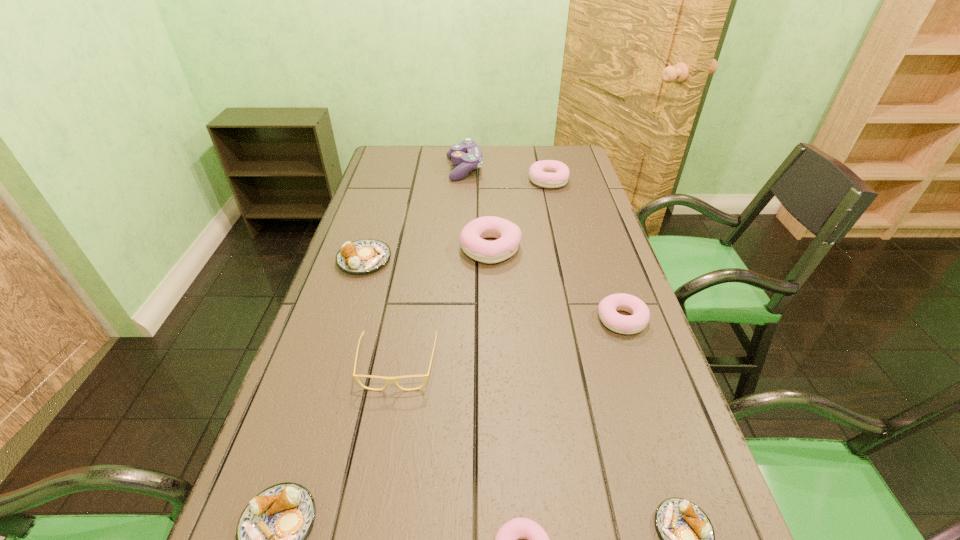
Where is `the third biggest pink pastry`? Image resolution: width=960 pixels, height=540 pixels. the third biggest pink pastry is located at coordinates (640, 315).

Where is `vacant region located 0.180m on the left of the control`? The height and width of the screenshot is (540, 960). vacant region located 0.180m on the left of the control is located at coordinates (396, 169).

The image size is (960, 540). I want to click on vacant space located 0.380m on the back of the tallest pastry, so click(489, 171).

You are a GUI agent. You are given a task and a screenshot of the screen. Output one action in this format:
    pyautogui.click(x=<x>, y=<y>)
    Task: Click on the free space located on the left of the farthest pink pastry
    The height and width of the screenshot is (540, 960).
    Given the screenshot: What is the action you would take?
    (441, 180)

Locate an element on the screen. This screenshot has height=540, width=960. free spot located on the right of the farthest brown pastry is located at coordinates (514, 260).

The width and height of the screenshot is (960, 540). Identify the location of free space located in front of the lenses of the beige spectacles. (381, 458).

The height and width of the screenshot is (540, 960). Identify the location of vacant area situated on the left of the fourth farthest pastry. (489, 320).

Locate an element on the screen. This screenshot has width=960, height=540. control that is at the far edge is located at coordinates (467, 154).

Locate an element on the screen. The image size is (960, 540). pastry located at the far edge is located at coordinates (547, 173).

Find the location of a particular element. pastry present at the left edge is located at coordinates (366, 255).